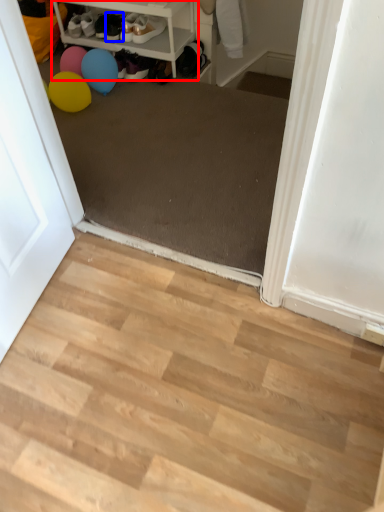
Question: Among these objects, which one is farthest to the camera, shelf (highlighted by a red box) or footwear (highlighted by a blue box)?

Choices:
 (A) shelf
 (B) footwear

Answer: (B)